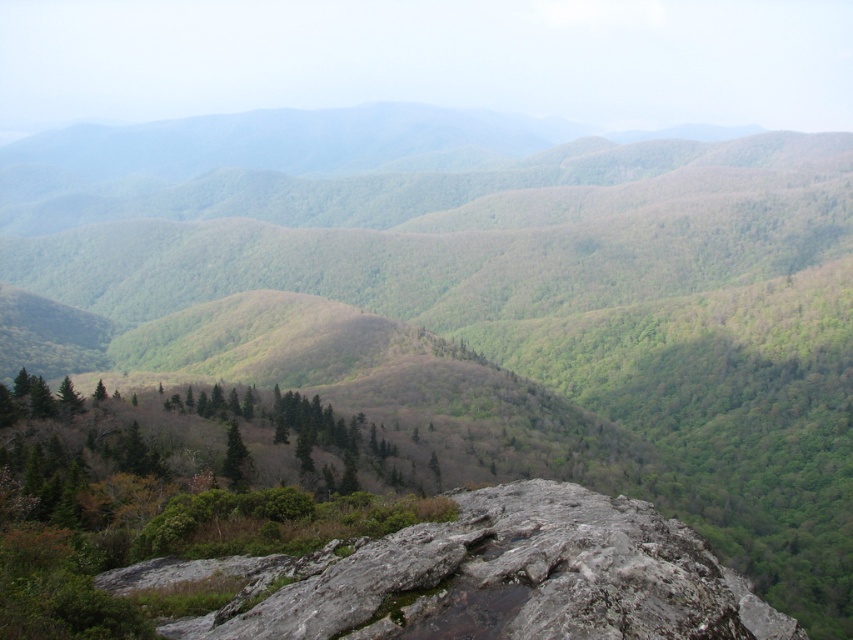
Question: Which point is farther from the camera taking this photo?

Choices:
 (A) (312, 616)
 (B) (228, 472)

Answer: (B)

Question: Is gray rough rock at center positioned in front of green matte tree at center?

Choices:
 (A) no
 (B) yes

Answer: (B)

Question: Can you confirm if gray rough rock at center is positioned below green matte tree at center?

Choices:
 (A) no
 (B) yes

Answer: (A)

Question: Observing the image, what is the correct spatial positioning of gray rough rock at center in reference to green matte tree at center?

Choices:
 (A) below
 (B) above

Answer: (B)